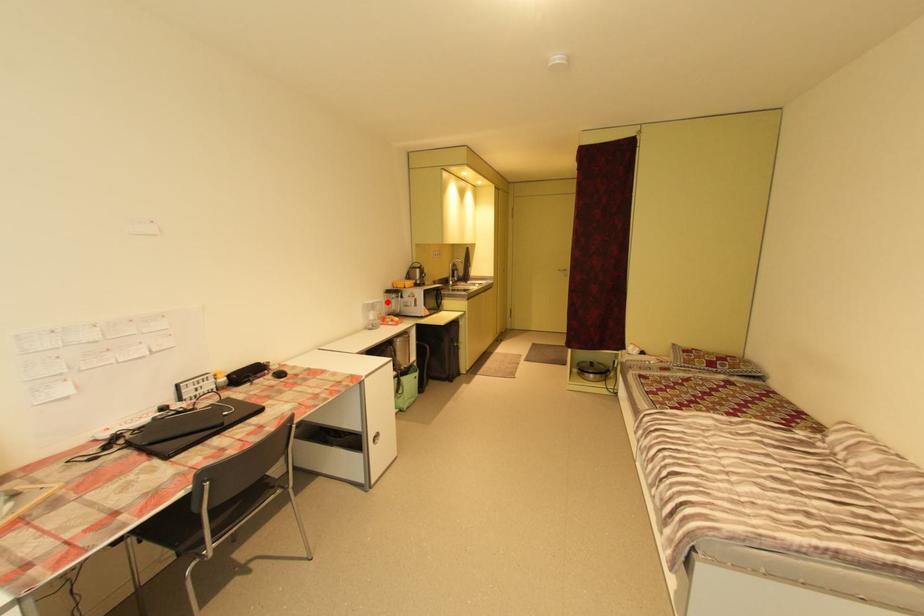
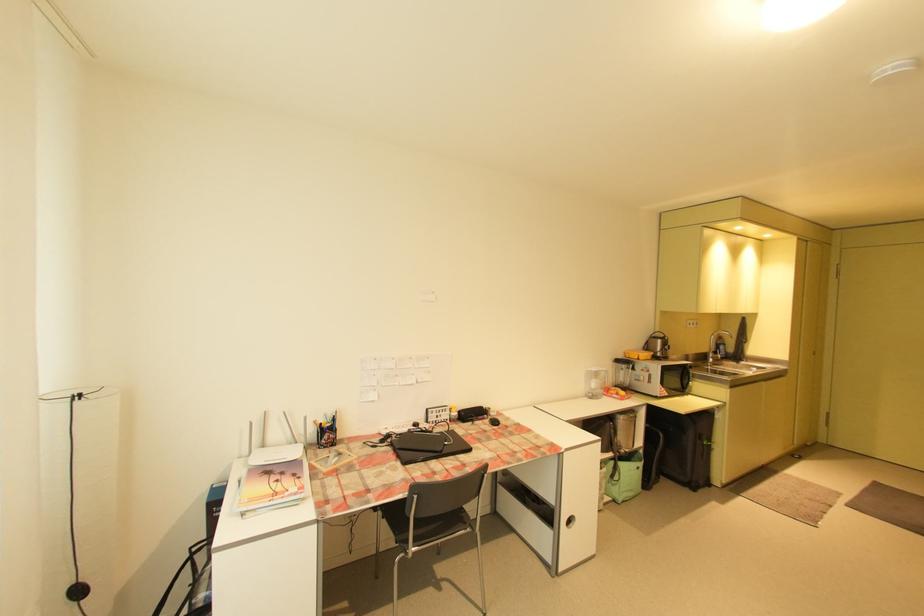
Where in the second image is the point corresponding to the highlighted location from the first image?

(613, 371)